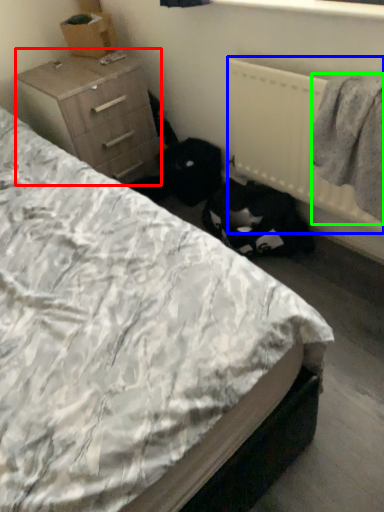
Question: Estimate the real-world distances between objects in this image. Which object is closer to chest of drawers (highlighted by a red box), radiator (highlighted by a blue box) or clothing (highlighted by a green box)?

Choices:
 (A) radiator
 (B) clothing

Answer: (A)